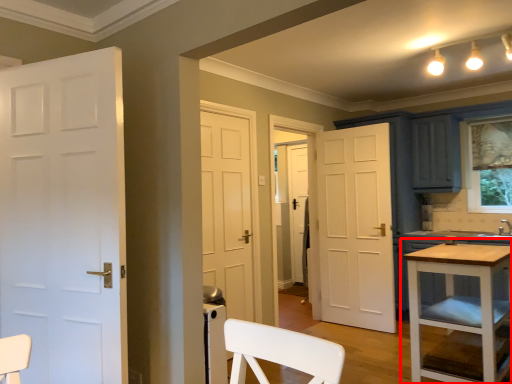
Question: Where is table (annotated by the red box) located in relation to door in the image?

Choices:
 (A) left
 (B) right

Answer: (B)